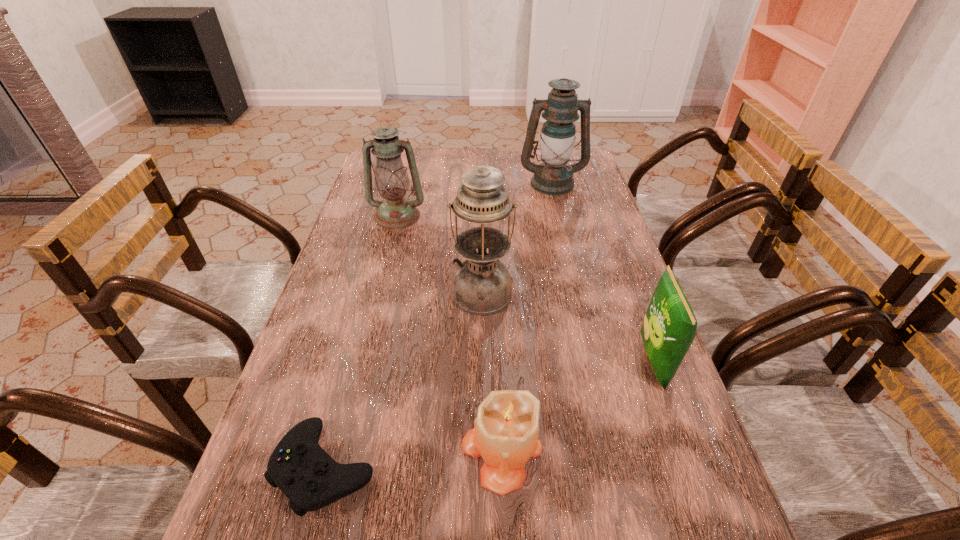
Find the location of a particular element. oil lamp that is the closest to the farthest oil lamp is located at coordinates (395, 211).

Where is `free space in the image that satisfies the following two spatial constraints: 1. on the back side of the rightmost oil lamp; 2. on the right side of the control`? The width and height of the screenshot is (960, 540). free space in the image that satisfies the following two spatial constraints: 1. on the back side of the rightmost oil lamp; 2. on the right side of the control is located at coordinates [400, 183].